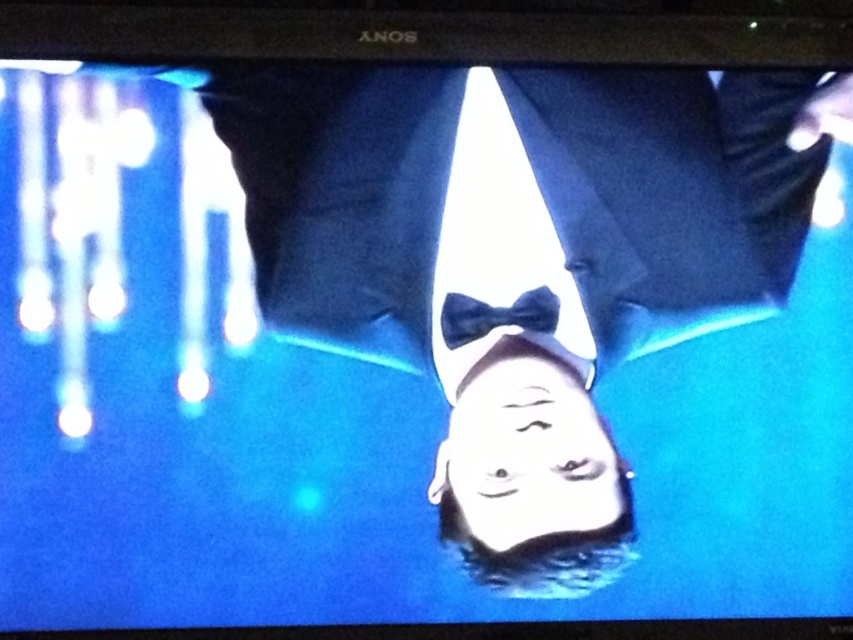
Between smooth black bow tie at center and velvet blue bow tie at center, which one is positioned higher?

Positioned higher is smooth black bow tie at center.

Between smooth black bow tie at center and velvet blue bow tie at center, which one appears on the right side from the viewer's perspective?

From the viewer's perspective, smooth black bow tie at center appears more on the right side.

Describe the element at coordinates (521, 259) in the screenshot. This screenshot has width=853, height=640. I see `smooth black bow tie at center` at that location.

You are a GUI agent. You are given a task and a screenshot of the screen. Output one action in this format:
    pyautogui.click(x=<x>, y=<y>)
    Task: Click on the smooth black bow tie at center
    
    Given the screenshot: What is the action you would take?
    pyautogui.click(x=521, y=259)